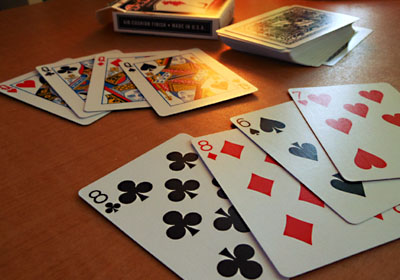
The height and width of the screenshot is (280, 400). Identify the location of wooden table. (76, 154).